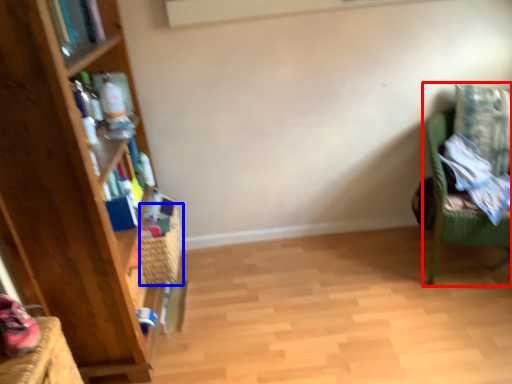
Question: Which of the following is the closest to the observer, chair (highlighted by a red box) or basket (highlighted by a blue box)?

Choices:
 (A) chair
 (B) basket

Answer: (A)